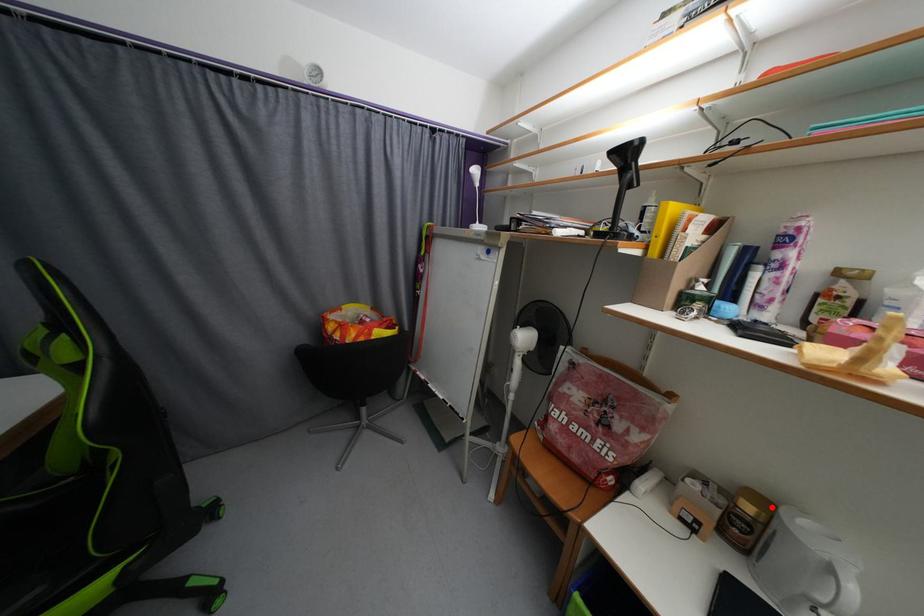
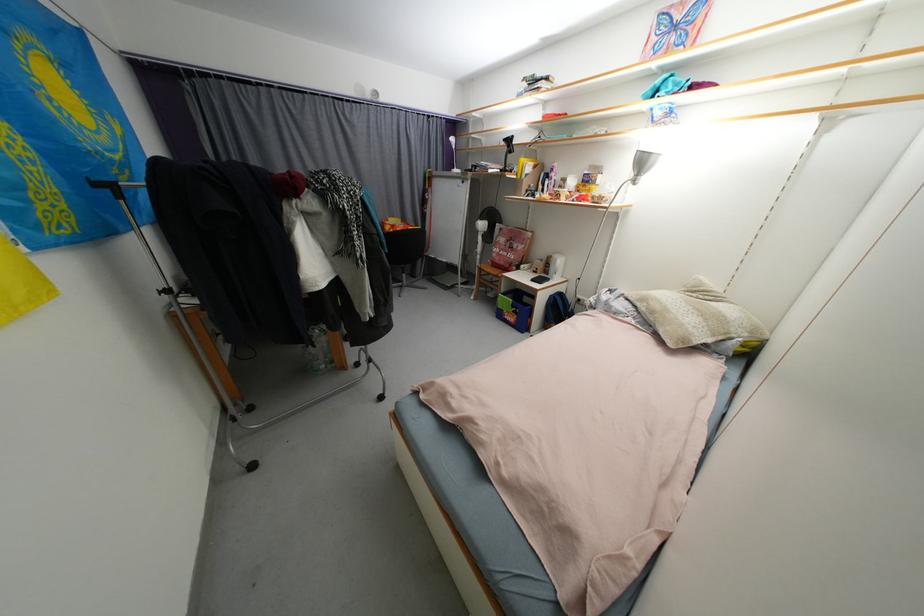
Question: I am providing you with two images of the same scene from different viewpoints. In image1, a red point is highlighted. Considering the same 3D point in image2, which of the following is correct?

Choices:
 (A) It is closer
 (B) It is farther

Answer: (A)